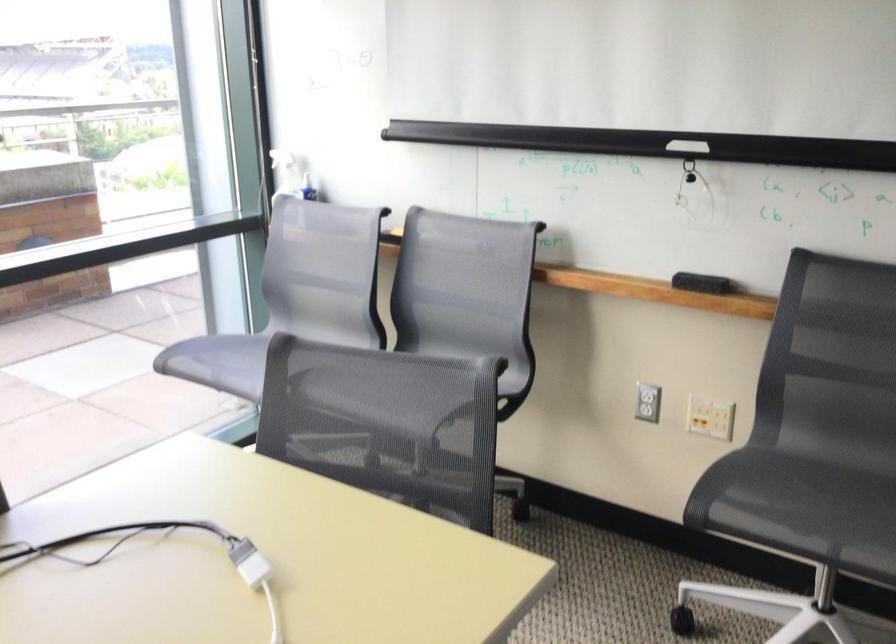
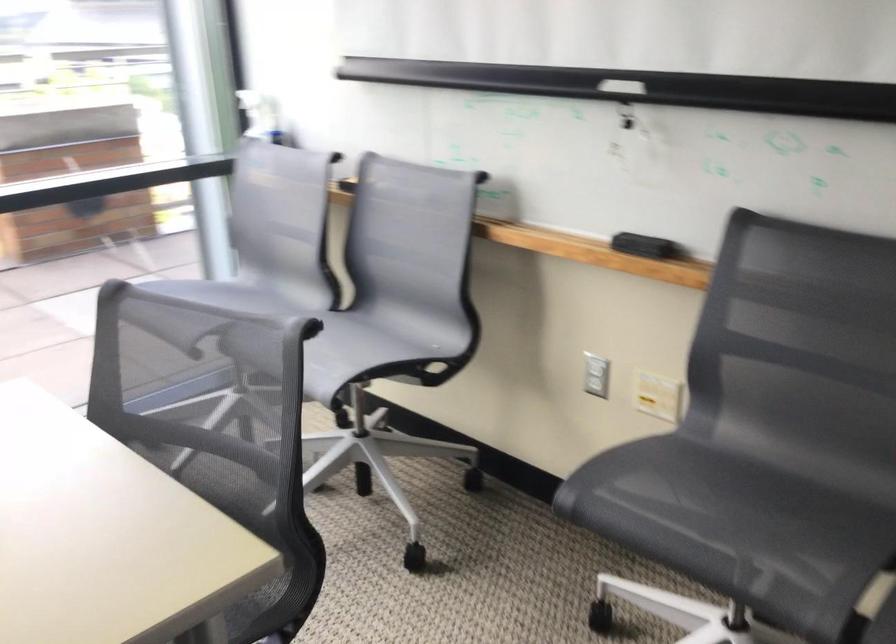
In the second image, find the point that corresponds to pixel 291 174 in the first image.

(260, 116)